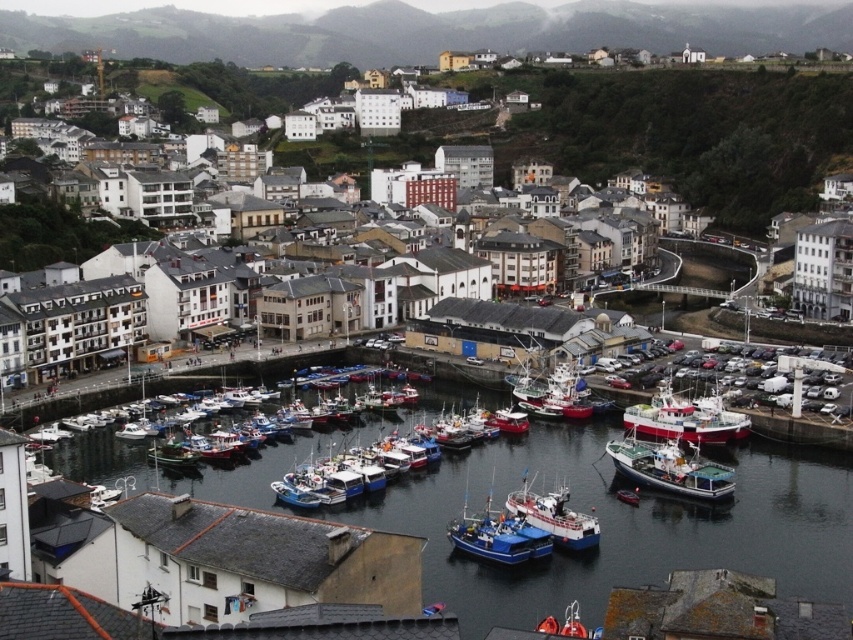
Question: Which point appears closest to the camera in this image?

Choices:
 (A) [x=524, y=509]
 (B) [x=605, y=532]
 (C) [x=553, y=376]

Answer: (A)

Question: Which is farther from the white plastic boat at center?

Choices:
 (A) smooth water at center
 (B) blue painted wooden boat at center
 (C) white matte buildings at center

Answer: (C)

Question: From the image, what is the correct spatial relationship of smooth water at center in relation to white wooden boat at lower right?

Choices:
 (A) below
 (B) above

Answer: (A)

Question: Does blue painted wooden boat at center have a lesser width compared to white plastic boat at center?

Choices:
 (A) yes
 (B) no

Answer: (B)

Question: Can you confirm if white wooden boat at lower right is positioned below blue painted wooden boat at center?

Choices:
 (A) yes
 (B) no

Answer: (B)

Question: Which is farther from the white matte buildings at center?

Choices:
 (A) white wooden boat at center
 (B) blue painted wooden boat at center
 (C) smooth water at center
 (D) white matte fishing boat at center

Answer: (B)